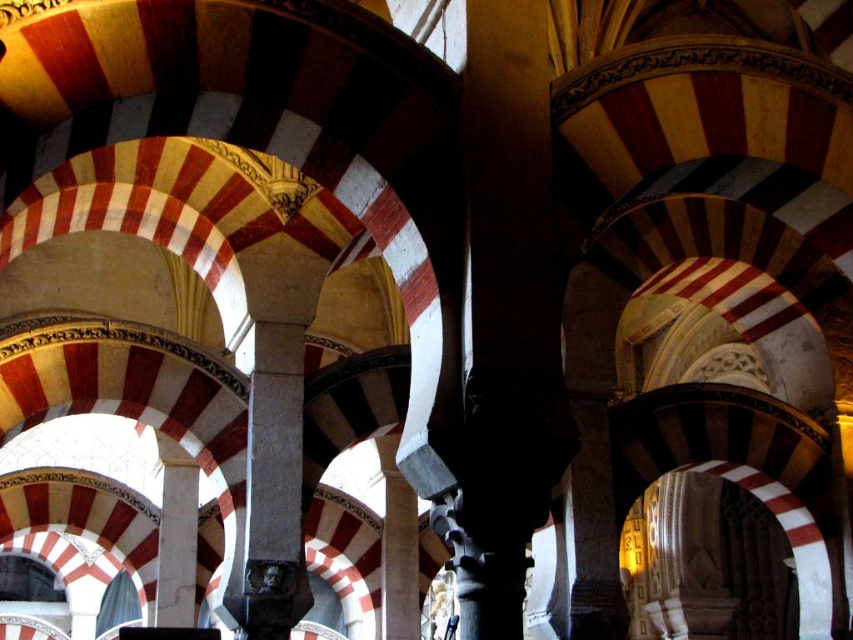
Question: Can you confirm if black polished stone column at center is wider than dark gray stone column at center?

Choices:
 (A) yes
 (B) no

Answer: (A)

Question: Among these objects, which one is farthest from the camera?

Choices:
 (A) dark gray stone column at center
 (B) black polished stone column at center

Answer: (A)

Question: Which of the following is the farthest from the observer?

Choices:
 (A) (300, 611)
 (B) (514, 61)

Answer: (A)

Question: Does black polished stone column at center appear on the right side of dark gray stone column at center?

Choices:
 (A) no
 (B) yes

Answer: (B)

Question: Can you confirm if black polished stone column at center is positioned to the right of dark gray stone column at center?

Choices:
 (A) no
 (B) yes

Answer: (B)